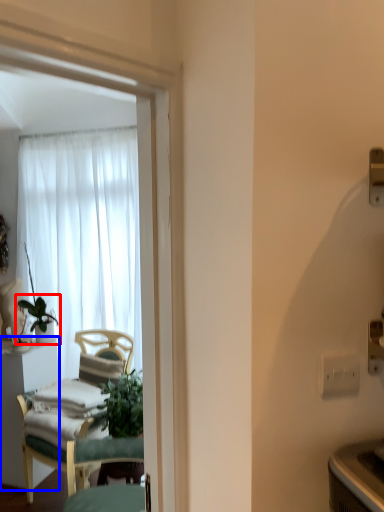
Question: Which object is closer to the camera taking this photo, houseplant (highlighted by a red box) or desk (highlighted by a blue box)?

Choices:
 (A) houseplant
 (B) desk

Answer: (B)